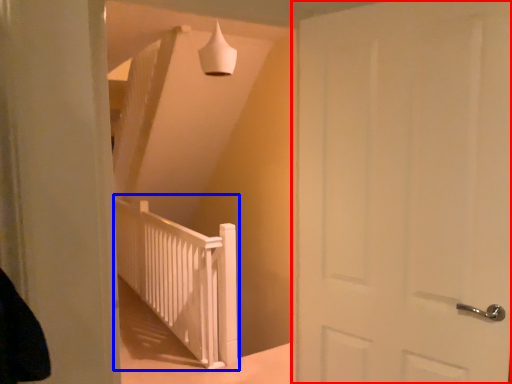
Question: Which of the following is the closest to the observer, door (highlighted by a red box) or rail (highlighted by a blue box)?

Choices:
 (A) door
 (B) rail

Answer: (A)